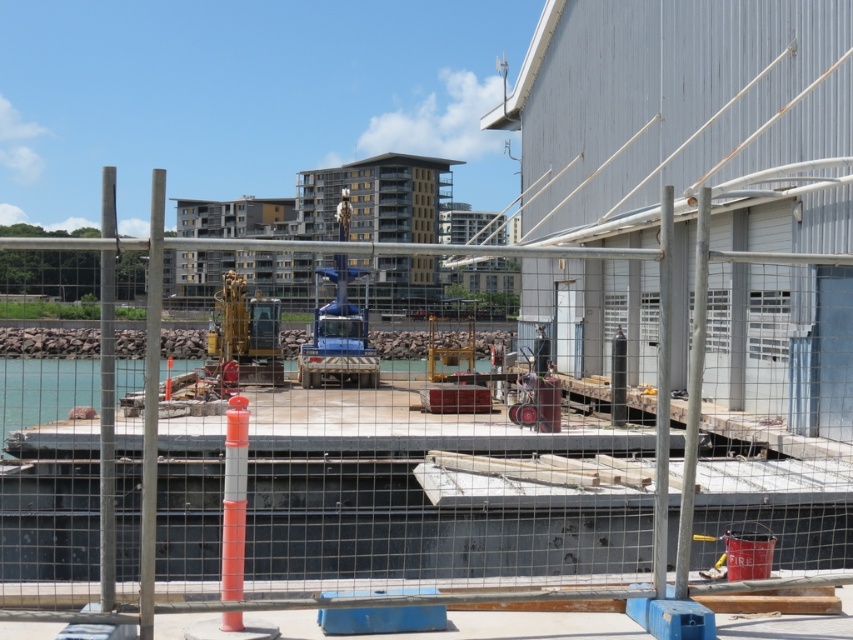
Looking at this image, you are a construction worker who needs to move a heavy equipment from the gold metallic excavator at center to the matte concrete platform at center. Considering their sizes, which one can accommodate the equipment more easily?

The matte concrete platform at center is bigger than the gold metallic excavator at center, so it can accommodate the equipment more easily.

You are a construction worker who needs to place a heavy equipment on the matte concrete platform at center. Given the coordinates provided, can you confirm the exact position where the platform is located?

The matte concrete platform at center is located at the 2D coordinates point (380, 464).

You are a construction worker who needs to move heavy equipment from the matte concrete platform at center to the clear water at center. Considering the size difference between the two, which area can support the weight of the equipment better?

The matte concrete platform at center has a larger size compared to clear water at center, so it can support the weight of the equipment better than the clear water at center.